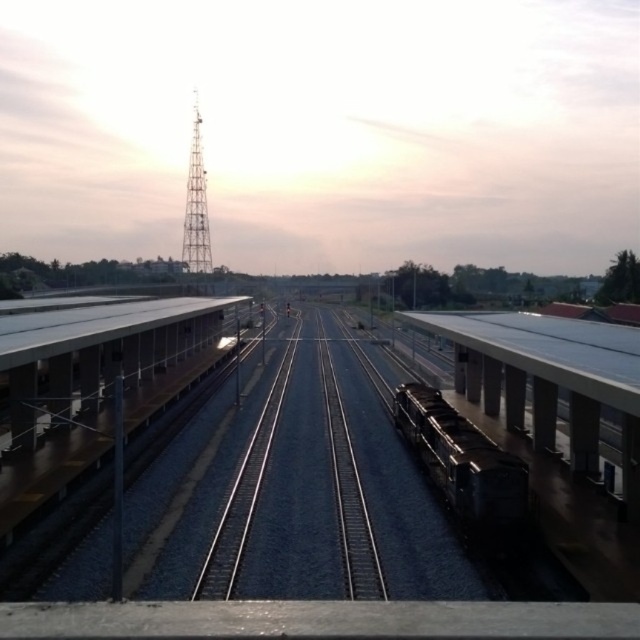
You are a passenger waiting at the railway station. You see the shiny black train at center and the metallic lattice tower at center. Which one is closer to the ground?

The shiny black train at center is closer to the ground because it is below the metallic lattice tower at center.

You are standing at the point marked as point [256,481] in the image. What surface are you standing on?

The point [256,481] is on metal smooth train track at center, so you are standing on the metal smooth train track at center.